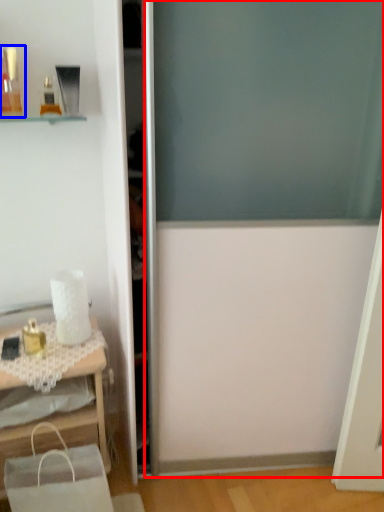
Question: Which object appears farthest to the camera in this image, screen door (highlighted by a red box) or toiletry (highlighted by a blue box)?

Choices:
 (A) screen door
 (B) toiletry

Answer: (B)